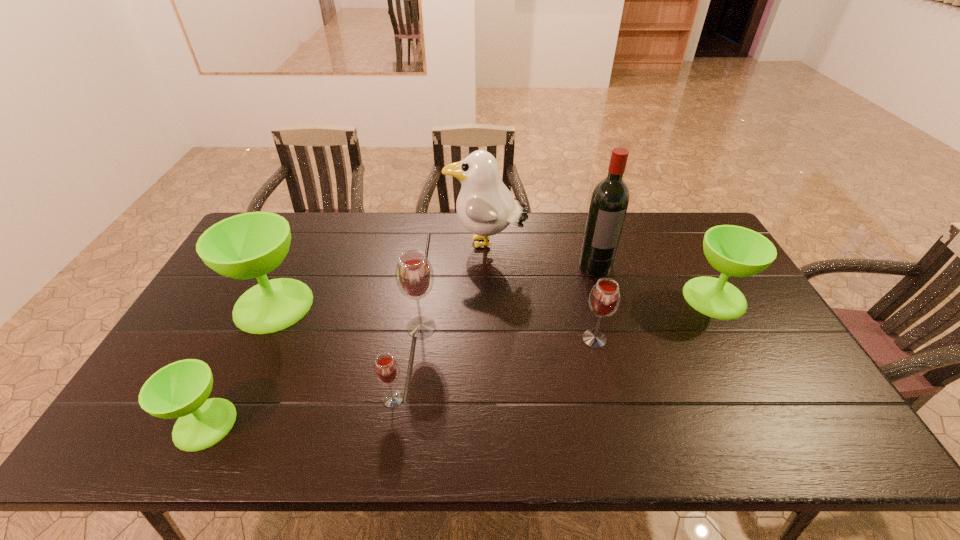
Locate an element on the screen. This screenshot has height=540, width=960. red wine bottle is located at coordinates (609, 202).

Find the location of a particular element. This screenshot has height=540, width=960. gull is located at coordinates (485, 207).

Find the location of `the second tallest object`. the second tallest object is located at coordinates (485, 207).

Find the location of a particular element. the biggest red wineglass is located at coordinates coord(414,274).

Where is `the biggest green wineglass`? The height and width of the screenshot is (540, 960). the biggest green wineglass is located at coordinates (250, 245).

Find the location of a particular element. This screenshot has height=540, width=960. the rightmost object is located at coordinates (736, 251).

The height and width of the screenshot is (540, 960). Find the location of `the rightmost green wineglass`. the rightmost green wineglass is located at coordinates (736, 251).

This screenshot has height=540, width=960. Find the location of `the rightmost red wineglass`. the rightmost red wineglass is located at coordinates (604, 299).

The height and width of the screenshot is (540, 960). What are the coordinates of `the fifth wineglass from left to right` in the screenshot? It's located at (604, 299).

Find the location of a particular element. the smallest red wineglass is located at coordinates (386, 369).